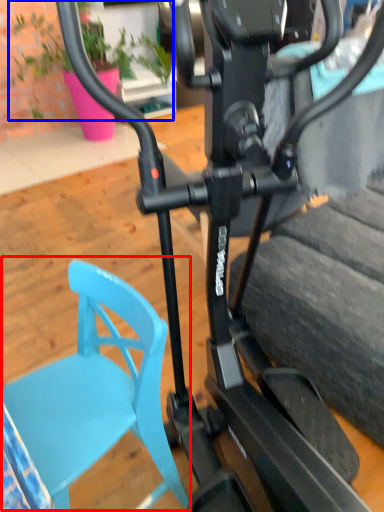
Question: Which object appears closest to the camera in this image, swivel chair (highlighted by a red box) or plant (highlighted by a blue box)?

Choices:
 (A) swivel chair
 (B) plant

Answer: (A)